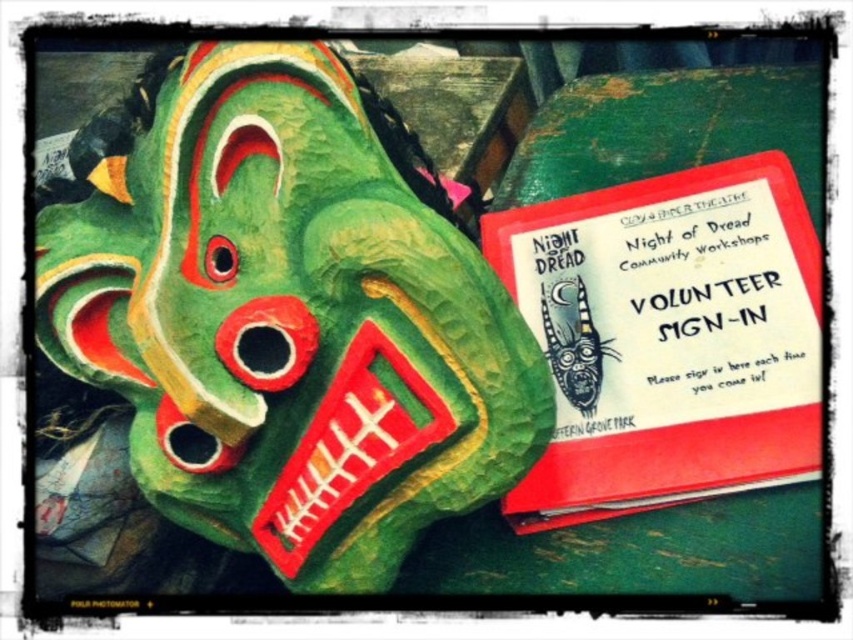
Does green papier-mâché mask at left have a greater height compared to green papier-mâché dragon at center?

Correct, green papier-mâché mask at left is much taller as green papier-mâché dragon at center.

Can you confirm if green papier-mâché mask at left is bigger than green papier-mâché dragon at center?

Yes, green papier-mâché mask at left is bigger than green papier-mâché dragon at center.

This screenshot has height=640, width=853. What do you see at coordinates (285, 314) in the screenshot?
I see `green papier-mâché mask at left` at bounding box center [285, 314].

Identify the location of green papier-mâché mask at left. This screenshot has height=640, width=853. (285, 314).

Image resolution: width=853 pixels, height=640 pixels. What do you see at coordinates (285, 314) in the screenshot?
I see `green papier-mâché mask at left` at bounding box center [285, 314].

Who is lower down, green papier-mâché mask at left or red paper volunteer sign-in at right?

Positioned lower is red paper volunteer sign-in at right.

What do you see at coordinates (285, 314) in the screenshot?
I see `green papier-mâché mask at left` at bounding box center [285, 314].

What are the coordinates of `green papier-mâché mask at left` in the screenshot? It's located at (285, 314).

The height and width of the screenshot is (640, 853). What do you see at coordinates (668, 337) in the screenshot? I see `red paper volunteer sign-in at right` at bounding box center [668, 337].

Is red paper volunteer sign-in at right shorter than green papier-mâché dragon at center?

In fact, red paper volunteer sign-in at right may be taller than green papier-mâché dragon at center.

Which is behind, point (778, 227) or point (579, 324)?

The point (579, 324) is more distant.

This screenshot has width=853, height=640. I want to click on red paper volunteer sign-in at right, so click(668, 337).